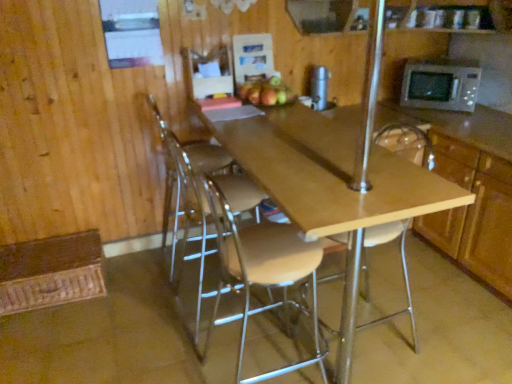
Question: Considering the relative positions of matte brown apple at center and light wood/matte table at center in the image provided, is matte brown apple at center behind light wood/matte table at center?

Choices:
 (A) no
 (B) yes

Answer: (B)

Question: Does matte brown apple at center turn towards light wood/matte table at center?

Choices:
 (A) no
 (B) yes

Answer: (A)

Question: From a real-world perspective, is matte brown apple at center located beneath light wood/matte table at center?

Choices:
 (A) yes
 (B) no

Answer: (B)

Question: Is matte brown apple at center smaller than light wood/matte table at center?

Choices:
 (A) no
 (B) yes

Answer: (B)

Question: Considering the relative positions of matte brown apple at center and light wood/matte table at center in the image provided, is matte brown apple at center to the right of light wood/matte table at center from the viewer's perspective?

Choices:
 (A) yes
 (B) no

Answer: (B)

Question: Is wooden cabinet at right taller or shorter than clear plastic chair at center, which is the third chair from right to left?

Choices:
 (A) short
 (B) tall

Answer: (A)

Question: From the image's perspective, is wooden cabinet at right located above or below clear plastic chair at center, which is counted as the first chair, starting from the left?

Choices:
 (A) below
 (B) above

Answer: (A)

Question: In the image, is wooden cabinet at right positioned in front of or behind clear plastic chair at center, which is the third chair from right to left?

Choices:
 (A) behind
 (B) front

Answer: (B)

Question: From a real-world perspective, relative to clear plastic chair at center, which is the third chair from right to left, is wooden cabinet at right vertically above or below?

Choices:
 (A) above
 (B) below

Answer: (B)

Question: Does point [382, 228] appear closer or farther from the camera than point [281, 87]?

Choices:
 (A) farther
 (B) closer

Answer: (A)

Question: From a real-world perspective, is wooden seat at center, the 1th chair positioned from the right, above or below matte brown apple at center?

Choices:
 (A) above
 (B) below

Answer: (B)

Question: Would you say wooden seat at center, placed as the 3th chair when sorted from left to right, is to the left or to the right of matte brown apple at center in the picture?

Choices:
 (A) left
 (B) right

Answer: (B)

Question: From the image's perspective, is wooden seat at center, placed as the 3th chair when sorted from left to right, positioned above or below matte brown apple at center?

Choices:
 (A) above
 (B) below

Answer: (B)

Question: Considering the relative positions of silver metallic thermos at upper center and matte brown apple at center in the image provided, is silver metallic thermos at upper center to the left or to the right of matte brown apple at center?

Choices:
 (A) left
 (B) right

Answer: (B)

Question: Do you think silver metallic thermos at upper center is within matte brown apple at center, or outside of it?

Choices:
 (A) inside
 (B) outside

Answer: (B)